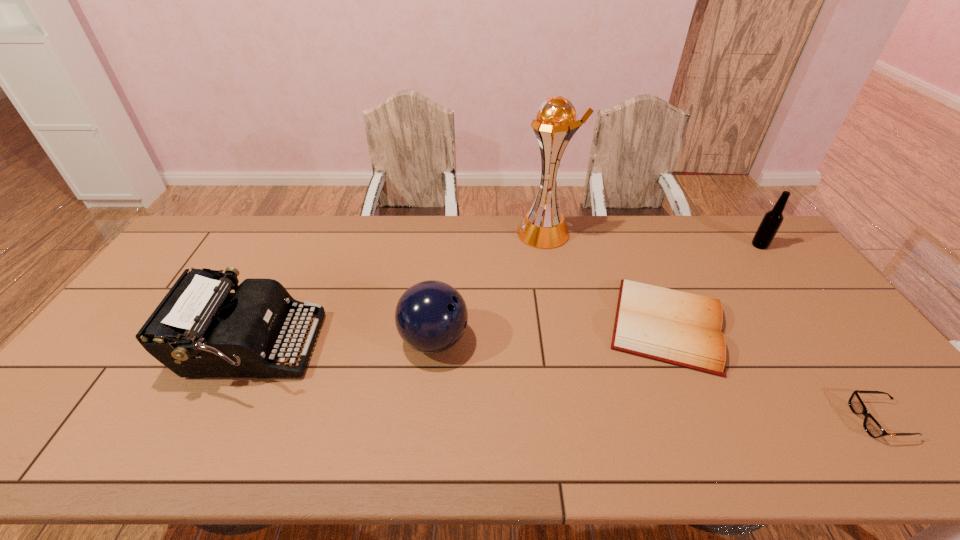
Locate an element on the screen. vacant area located on the left of the beer bottle is located at coordinates (662, 245).

Where is `vacant region located 0.130m on the surface of the bowling ball near the finger holes`? This screenshot has width=960, height=540. vacant region located 0.130m on the surface of the bowling ball near the finger holes is located at coordinates (516, 340).

Identify the location of vacant region located on the typing side of the leftmost object. coord(359,347).

Locate an element on the screen. This screenshot has height=540, width=960. vacant position located 0.290m on the right of the third object from right to left is located at coordinates (832, 325).

Find the location of a particular element. vacant space situated 0.280m on the front-facing side of the sunglasses is located at coordinates (737, 421).

You are a GUI agent. You are given a task and a screenshot of the screen. Output one action in this format:
    pyautogui.click(x=<x>, y=<y>)
    Task: Click on the vacant space located on the front-facing side of the sunglasses
    Image resolution: width=960 pixels, height=540 pixels.
    Given the screenshot: What is the action you would take?
    pyautogui.click(x=711, y=421)

Locate an element on the screen. The height and width of the screenshot is (540, 960). blank area located on the front-facing side of the sunglasses is located at coordinates (737, 421).

Find the location of a particular element. The height and width of the screenshot is (540, 960). trophy that is at the far edge is located at coordinates (544, 227).

You are a GUI agent. You are given a task and a screenshot of the screen. Output one action in this format:
    pyautogui.click(x=<x>, y=<y>)
    Task: Click on the beer bottle that is positioned at the far edge
    
    Given the screenshot: What is the action you would take?
    pyautogui.click(x=772, y=220)

The width and height of the screenshot is (960, 540). Find the location of `object that is at the near edge`. object that is at the near edge is located at coordinates (873, 428).